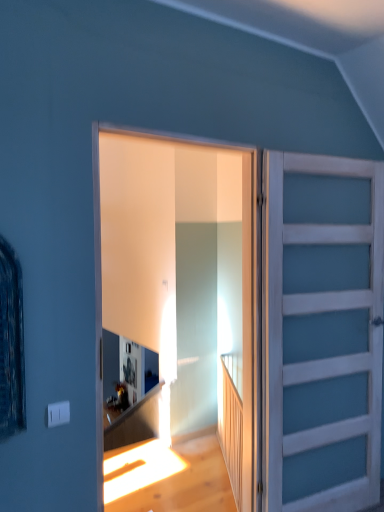
Question: Is translucent glass door at center, marked as the second door in a right-to-left arrangement, inside white painted wood door at right, the 1th door from the right?

Choices:
 (A) yes
 (B) no

Answer: (B)

Question: Is white painted wood door at right, the 2th door when ordered from left to right, in front of translucent glass door at center, marked as the second door in a right-to-left arrangement?

Choices:
 (A) no
 (B) yes

Answer: (A)

Question: Is white painted wood door at right, the 2th door when ordered from left to right, positioned far away from translucent glass door at center, marked as the second door in a right-to-left arrangement?

Choices:
 (A) no
 (B) yes

Answer: (A)

Question: Is white painted wood door at right, the 2th door when ordered from left to right, completely or partially outside of translucent glass door at center, marked as the second door in a right-to-left arrangement?

Choices:
 (A) yes
 (B) no

Answer: (A)

Question: Considering the relative sizes of white painted wood door at right, the 1th door from the right, and translucent glass door at center, marked as the second door in a right-to-left arrangement, in the image provided, is white painted wood door at right, the 1th door from the right, taller than translucent glass door at center, marked as the second door in a right-to-left arrangement,?

Choices:
 (A) no
 (B) yes

Answer: (B)

Question: Based on their positions, is white painted wood door at right, the 1th door from the right, located to the left or right of translucent glass door at center, marked as the second door in a right-to-left arrangement?

Choices:
 (A) right
 (B) left

Answer: (A)

Question: Is white painted wood door at right, the 1th door from the right, in front of or behind translucent glass door at center, marked as the second door in a right-to-left arrangement, in the image?

Choices:
 (A) behind
 (B) front

Answer: (A)

Question: Considering the positions of point (344, 500) and point (263, 377), is point (344, 500) closer or farther from the camera than point (263, 377)?

Choices:
 (A) closer
 (B) farther

Answer: (B)

Question: Considering the positions of white painted wood door at right, the 1th door from the right, and translucent glass door at center, marked as the second door in a right-to-left arrangement, in the image, is white painted wood door at right, the 1th door from the right, taller or shorter than translucent glass door at center, marked as the second door in a right-to-left arrangement,?

Choices:
 (A) tall
 (B) short

Answer: (A)

Question: Considering their positions, is translucent glass door at center, marked as the second door in a right-to-left arrangement, located in front of or behind wooden at right?

Choices:
 (A) front
 (B) behind

Answer: (A)

Question: Is translucent glass door at center, which is counted as the 1th door, starting from the left, taller or shorter than wooden at right?

Choices:
 (A) tall
 (B) short

Answer: (A)

Question: Would you say translucent glass door at center, marked as the second door in a right-to-left arrangement, is to the left or to the right of wooden at right in the picture?

Choices:
 (A) left
 (B) right

Answer: (A)

Question: From the image's perspective, is translucent glass door at center, which is counted as the 1th door, starting from the left, positioned above or below wooden at right?

Choices:
 (A) above
 (B) below

Answer: (A)

Question: Is wooden at right inside the boundaries of white painted wood door at right, the 2th door when ordered from left to right, or outside?

Choices:
 (A) inside
 (B) outside

Answer: (B)

Question: Would you say wooden at right is to the left or to the right of white painted wood door at right, the 2th door when ordered from left to right, in the picture?

Choices:
 (A) left
 (B) right

Answer: (A)